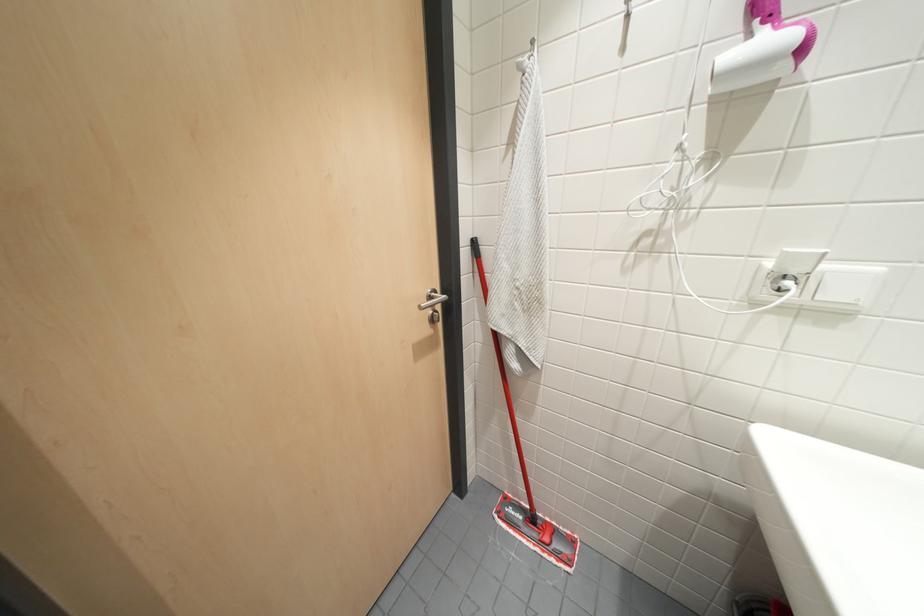
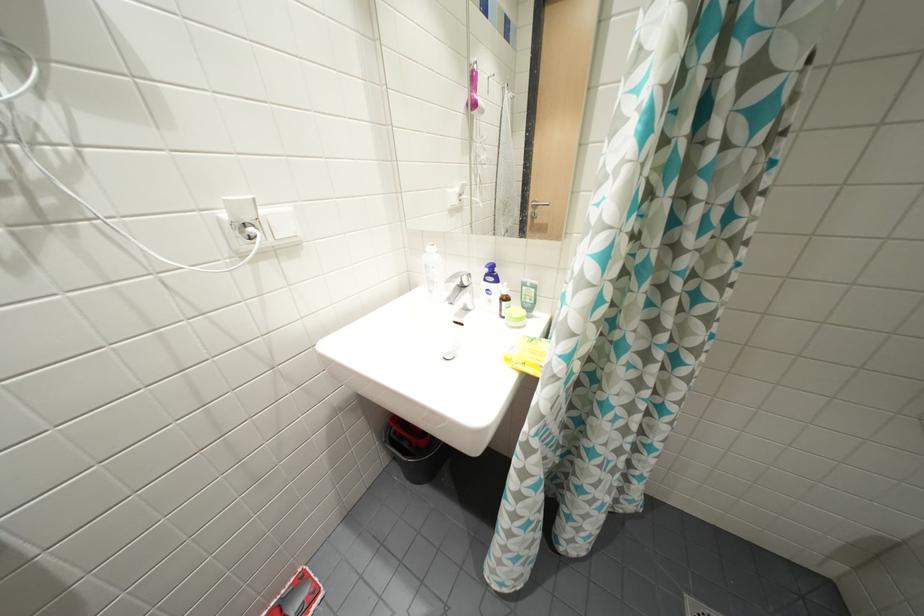
First-person continuous shooting, in which direction is the camera rotating?

The camera rotated toward right-down.